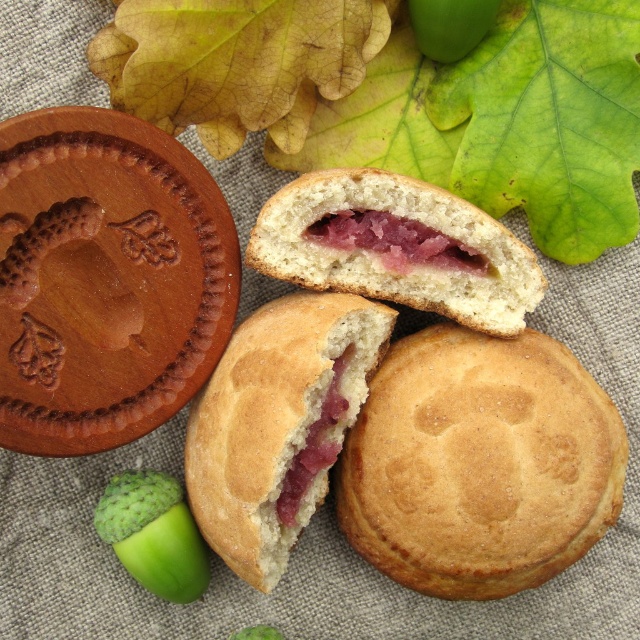
Question: Does golden-brown crumbly biscuit at center have a lesser width compared to golden crumbly biscuit at center?

Choices:
 (A) yes
 (B) no

Answer: (B)

Question: Can you confirm if golden crumbly biscuit at center is bigger than light brown crumbly biscuit at center?

Choices:
 (A) yes
 (B) no

Answer: (A)

Question: Which of the following is the closest to the observer?

Choices:
 (A) golden crumbly biscuit at center
 (B) light brown crumbly biscuit at center

Answer: (A)

Question: Which of the following is the closest to the observer?

Choices:
 (A) (298, 342)
 (B) (580, 460)

Answer: (B)

Question: Does golden-brown crumbly biscuit at center appear on the right side of light brown crumbly biscuit at center?

Choices:
 (A) yes
 (B) no

Answer: (A)

Question: Which point is farther from the camera taking this photo?

Choices:
 (A) (545, 531)
 (B) (292, 278)

Answer: (B)